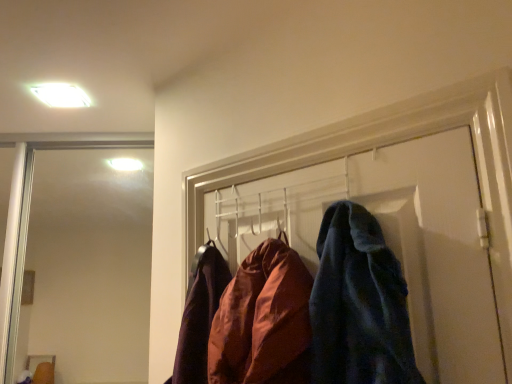
Question: Is velvety blue coat at center shorter than white glossy light fixture at upper left?

Choices:
 (A) no
 (B) yes

Answer: (A)

Question: From a real-world perspective, is velvety blue coat at center positioned over white glossy light fixture at upper left based on gravity?

Choices:
 (A) no
 (B) yes

Answer: (A)

Question: Is velvety blue coat at center oriented away from white glossy light fixture at upper left?

Choices:
 (A) no
 (B) yes

Answer: (A)

Question: Is velvety blue coat at center to the left of white glossy light fixture at upper left from the viewer's perspective?

Choices:
 (A) yes
 (B) no

Answer: (B)

Question: Does velvety blue coat at center come in front of white glossy light fixture at upper left?

Choices:
 (A) no
 (B) yes

Answer: (B)

Question: Considering the relative sizes of velvety blue coat at center and white glossy light fixture at upper left in the image provided, is velvety blue coat at center wider than white glossy light fixture at upper left?

Choices:
 (A) yes
 (B) no

Answer: (A)

Question: Is white glossy light fixture at upper left at the left side of velvety blue coat at center?

Choices:
 (A) yes
 (B) no

Answer: (A)

Question: From a real-world perspective, does white glossy light fixture at upper left stand above velvety blue coat at center?

Choices:
 (A) no
 (B) yes

Answer: (B)

Question: Is white glossy light fixture at upper left turned away from velvety blue coat at center?

Choices:
 (A) no
 (B) yes

Answer: (A)

Question: Can we say white glossy light fixture at upper left lies outside velvety blue coat at center?

Choices:
 (A) yes
 (B) no

Answer: (A)

Question: Is white glossy light fixture at upper left taller than velvety blue coat at center?

Choices:
 (A) yes
 (B) no

Answer: (B)

Question: Considering the relative sizes of white glossy light fixture at upper left and velvety blue coat at center in the image provided, is white glossy light fixture at upper left bigger than velvety blue coat at center?

Choices:
 (A) no
 (B) yes

Answer: (A)

Question: Looking at their shapes, would you say velvety blue coat at center is wider or thinner than white glossy light fixture at upper left?

Choices:
 (A) thin
 (B) wide

Answer: (B)